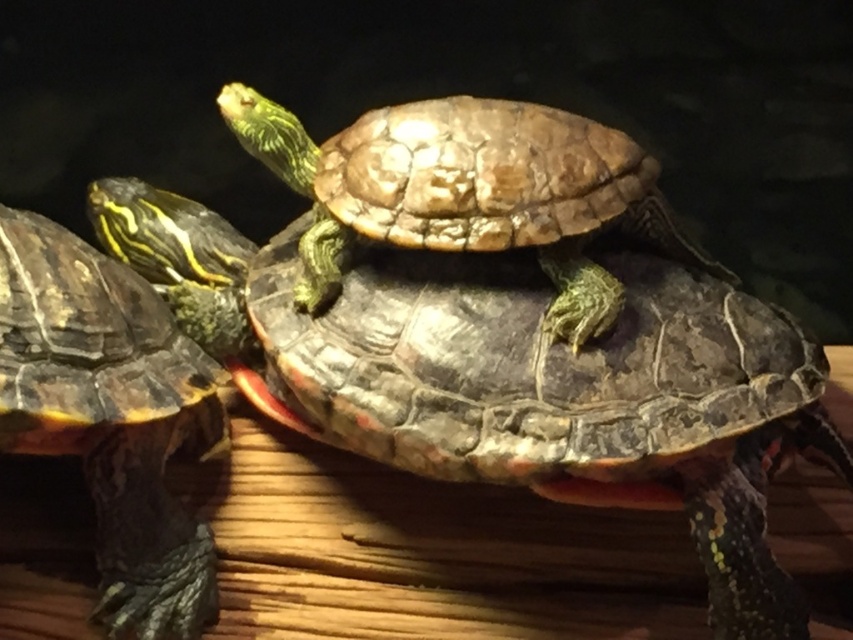
You are a zookeeper observing two turtles in their enclosure. You need to place a food bowl between them so that both can reach it easily. Given their positions, where should you place the food bowl relative to the shiny dark green tortoise at center and the shiny black tortoise at left?

The shiny dark green tortoise at center is positioned on the right side of the shiny black tortoise at left. To place the food bowl between them, it should be placed between the two turtles, to the left of the shiny dark green tortoise at center and to the right of the shiny black tortoise at left so both can reach it easily.

You are a zookeeper observing two turtles in their enclosure. You notice the shiny dark green tortoise at center and the shiny brown tortoise at center. Which turtle is positioned lower in the enclosure?

The shiny dark green tortoise at center is positioned below the shiny brown tortoise at center, so it is lower in the enclosure.